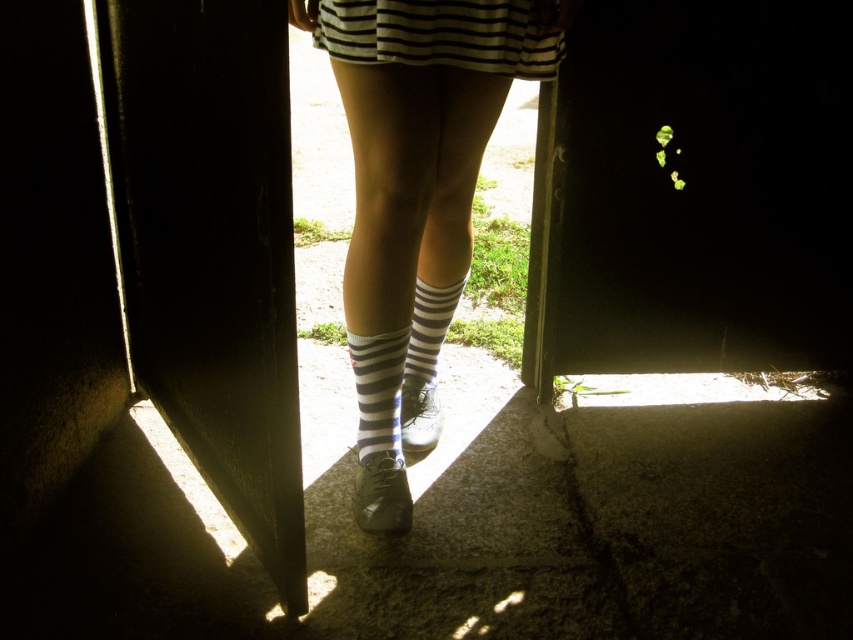
Question: Which point appears closest to the camera in this image?

Choices:
 (A) (410, 380)
 (B) (463, 148)

Answer: (B)

Question: Can you confirm if black matte door at center is positioned above striped cotton sock at center?

Choices:
 (A) yes
 (B) no

Answer: (A)

Question: Among these objects, which one is farthest from the camera?

Choices:
 (A) striped fabric dress at upper center
 (B) striped cotton sock at center

Answer: (B)

Question: From the image, what is the correct spatial relationship of striped cotton sock at center in relation to striped cotton socks at center?

Choices:
 (A) left
 (B) right

Answer: (A)

Question: Does striped fabric dress at upper center appear under striped cotton sock at center?

Choices:
 (A) no
 (B) yes

Answer: (A)

Question: Which of these objects is positioned farthest from the striped fabric dress at upper center?

Choices:
 (A) striped cotton socks at center
 (B) black matte door at center
 (C) white striped socks at center
 (D) striped cotton sock at center

Answer: (D)